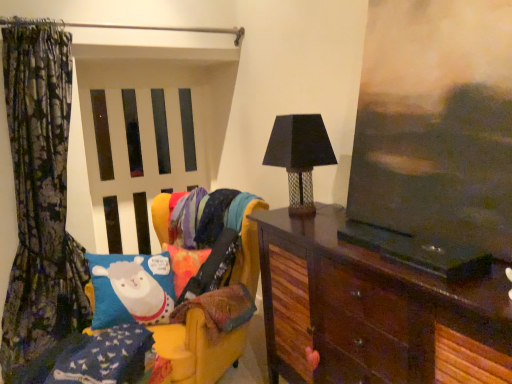
Where is `free space above white matte screen door at center (from a real-world perspective)`? The height and width of the screenshot is (384, 512). free space above white matte screen door at center (from a real-world perspective) is located at coordinates (153, 72).